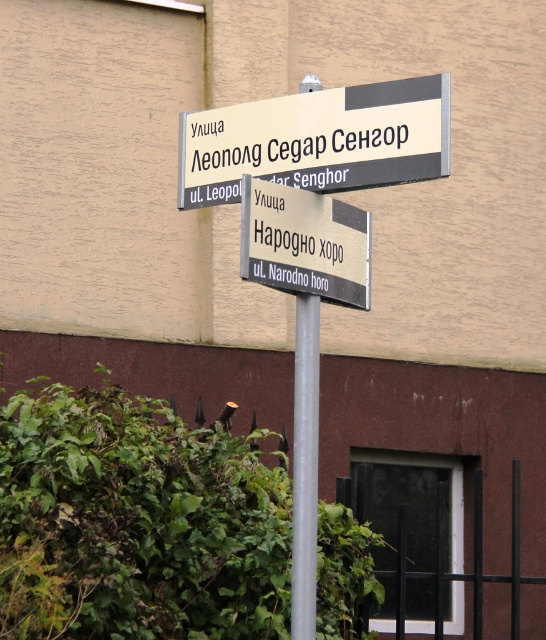
Question: From the image, what is the correct spatial relationship of matte plastic street sign at upper center in relation to metallic silver sign at center?

Choices:
 (A) above
 (B) below

Answer: (A)

Question: Does matte plastic street sign at upper center have a lesser width compared to metallic silver sign at center?

Choices:
 (A) no
 (B) yes

Answer: (A)

Question: Is matte plastic street sign at upper center below metallic silver sign at center?

Choices:
 (A) yes
 (B) no

Answer: (B)

Question: Which point is closer to the camera?

Choices:
 (A) (364, 96)
 (B) (286, 241)

Answer: (A)